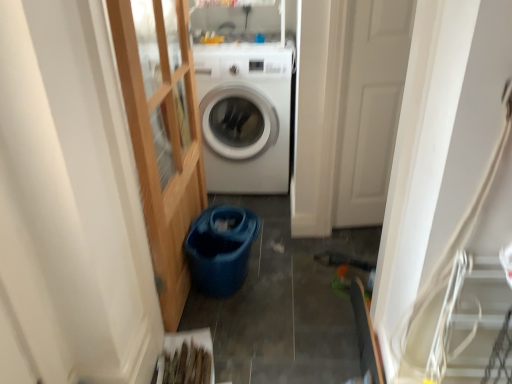
Question: Is white matte door at center situated inside clear glass door at left or outside?

Choices:
 (A) inside
 (B) outside

Answer: (B)

Question: Is white matte door at center in front of or behind clear glass door at left in the image?

Choices:
 (A) front
 (B) behind

Answer: (B)

Question: Which object is the closest to the white matte door at center?

Choices:
 (A) clear glass door at left
 (B) white glossy washing machine at center

Answer: (B)

Question: Which of these objects is positioned farthest from the white glossy washing machine at center?

Choices:
 (A) clear glass door at left
 (B) white matte door at center

Answer: (B)